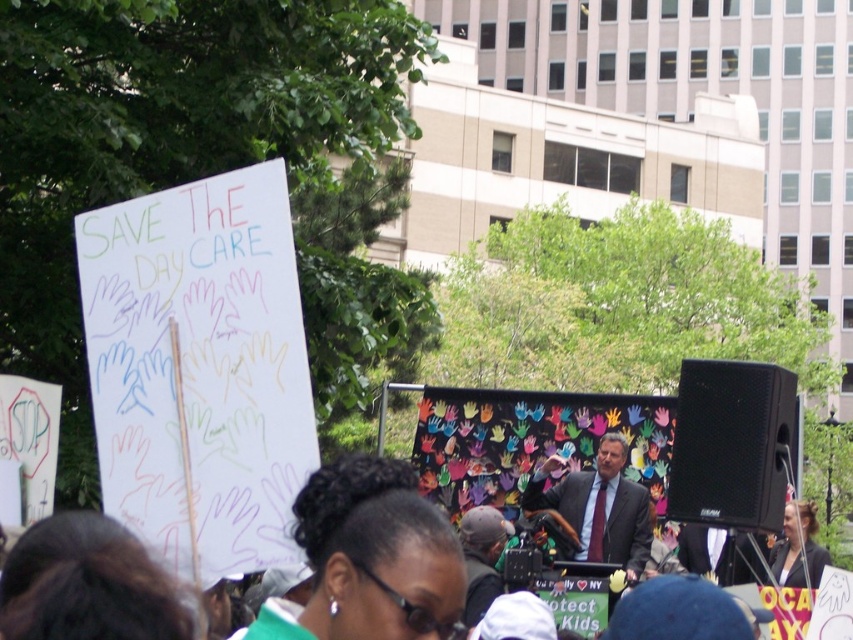
Question: Which of the following is the farthest from the observer?

Choices:
 (A) pyautogui.click(x=680, y=371)
 (B) pyautogui.click(x=601, y=500)

Answer: (A)

Question: Is black plastic speaker at center-right positioned at the back of matte black suit at center?

Choices:
 (A) no
 (B) yes

Answer: (A)

Question: Can you confirm if black plastic speaker at center-right is wider than matte black suit at center?

Choices:
 (A) yes
 (B) no

Answer: (B)

Question: Which object is farther from the camera taking this photo?

Choices:
 (A) black plastic speaker at center-right
 (B) matte black suit at center

Answer: (B)

Question: Which point is farther to the camera?

Choices:
 (A) black plastic speaker at center-right
 (B) matte black suit at center

Answer: (B)

Question: Is black plastic speaker at center-right positioned in front of matte black suit at center?

Choices:
 (A) no
 (B) yes

Answer: (B)